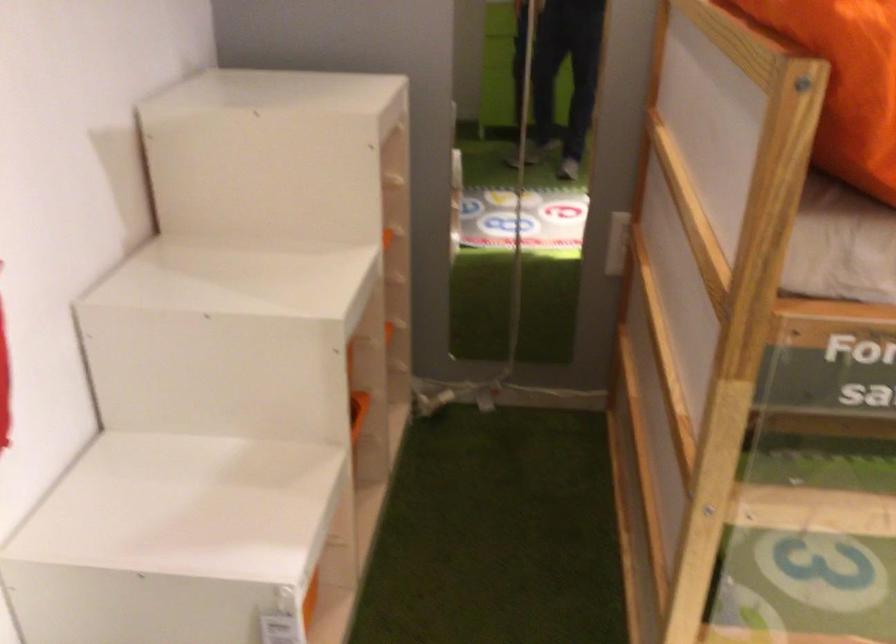
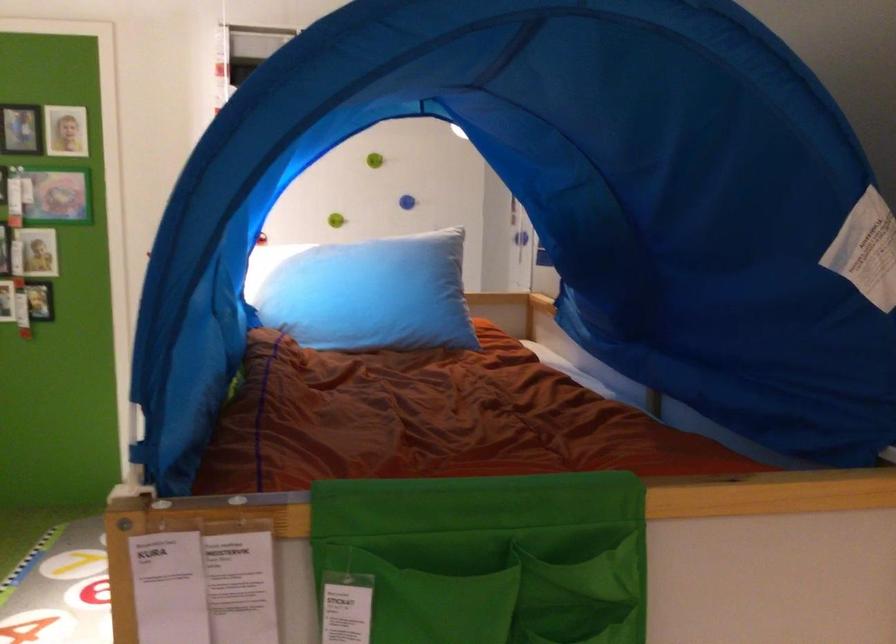
Question: I am providing you with two images of the same scene from different viewpoints. After the viewpoint changes to image2, which objects are now occluded?

Choices:
 (A) light blue pillow
 (B) blue wall knob
 (C) wooden ladder rung
 (D) light colored mug

Answer: (C)